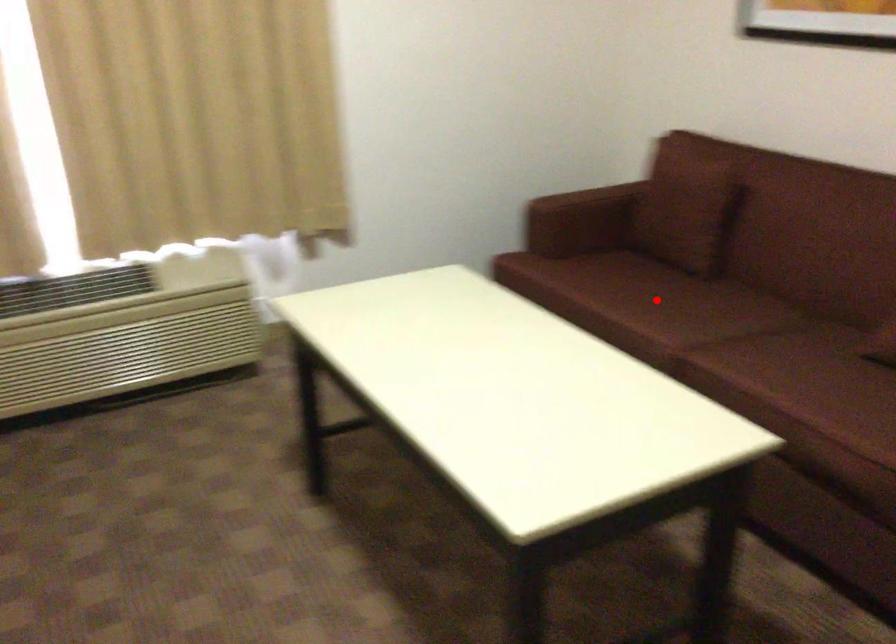
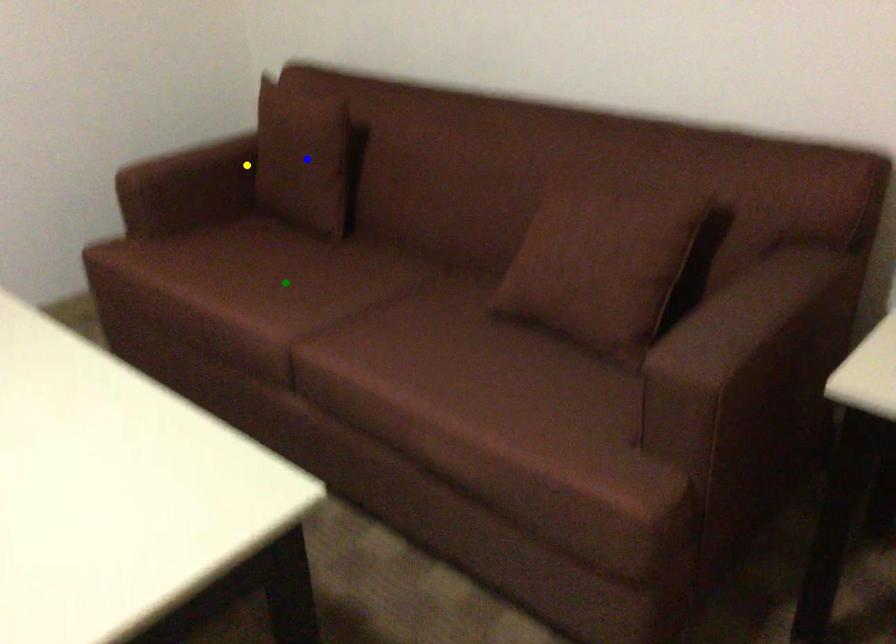
Question: I am providing you with two images of the same scene from different viewpoints. A red point is marked on the first image. You are given multiple points on the second image. Can you choose the point in image 2 that corresponds to the point in image 1?

Choices:
 (A) green point
 (B) yellow point
 (C) blue point

Answer: (A)